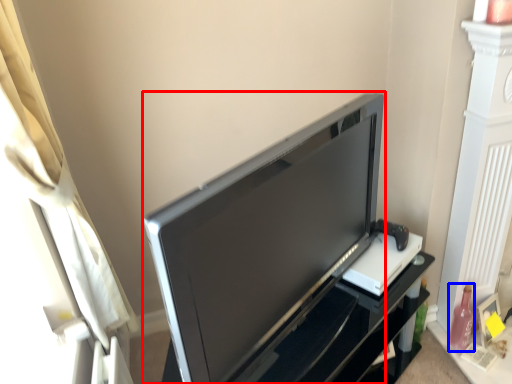
Question: Which of the following is the farthest to the observer, television (highlighted by a red box) or bottle (highlighted by a blue box)?

Choices:
 (A) television
 (B) bottle

Answer: (B)